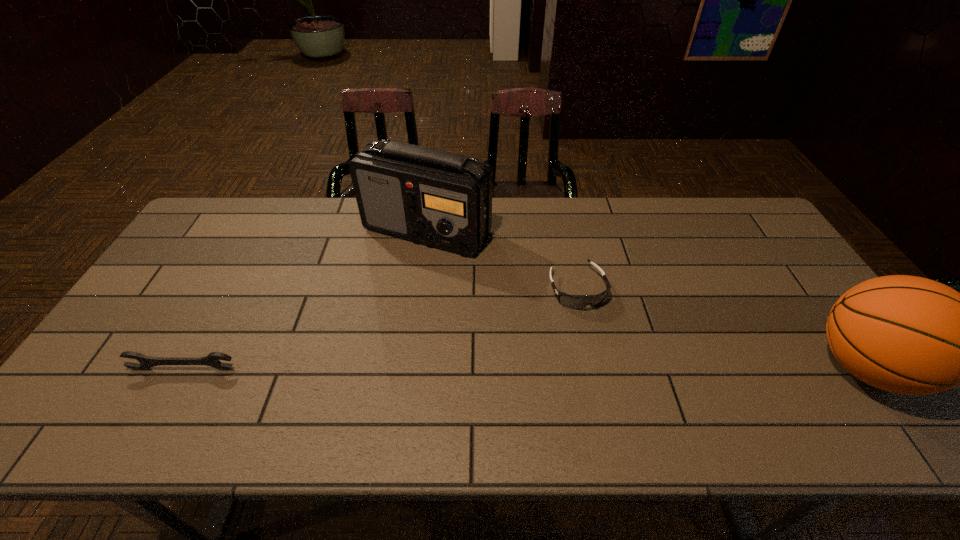
Locate an element on the screen. This screenshot has width=960, height=540. vacant region at the near left corner of the desktop is located at coordinates (132, 386).

In order to click on free location at the near right corner in this screenshot , I will do `click(859, 392)`.

You are a GUI agent. You are given a task and a screenshot of the screen. Output one action in this format:
    pyautogui.click(x=<x>, y=<y>)
    Task: Click on the unoccupied position between the third object from right to left and the third object from left to right
    The height and width of the screenshot is (540, 960).
    Given the screenshot: What is the action you would take?
    pyautogui.click(x=502, y=260)

You are a GUI agent. You are given a task and a screenshot of the screen. Output one action in this format:
    pyautogui.click(x=<x>, y=<y>)
    Task: Click on the empty space that is in between the second object from left to right and the wrench
    
    Given the screenshot: What is the action you would take?
    pyautogui.click(x=305, y=300)

Where is `unoccupied position between the third object from right to left and the wrench`? unoccupied position between the third object from right to left and the wrench is located at coordinates (305, 300).

You are a GUI agent. You are given a task and a screenshot of the screen. Output one action in this format:
    pyautogui.click(x=<x>, y=<y>)
    Task: Click on the free space that is in between the radio receiver and the leftmost object
    
    Given the screenshot: What is the action you would take?
    pyautogui.click(x=305, y=300)

You are a GUI agent. You are given a task and a screenshot of the screen. Output one action in this format:
    pyautogui.click(x=<x>, y=<y>)
    Task: Click on the blank region between the second farthest object and the second object from left to right
    
    Given the screenshot: What is the action you would take?
    pyautogui.click(x=502, y=260)

Where is `free space between the leftmost object and the second farthest object`? The width and height of the screenshot is (960, 540). free space between the leftmost object and the second farthest object is located at coordinates (380, 329).

Find the location of `vacant region between the radio receiver and the wrench`. vacant region between the radio receiver and the wrench is located at coordinates (305, 300).

Locate an element on the screen. The height and width of the screenshot is (540, 960). object identified as the third closest to the basketball is located at coordinates (213, 359).